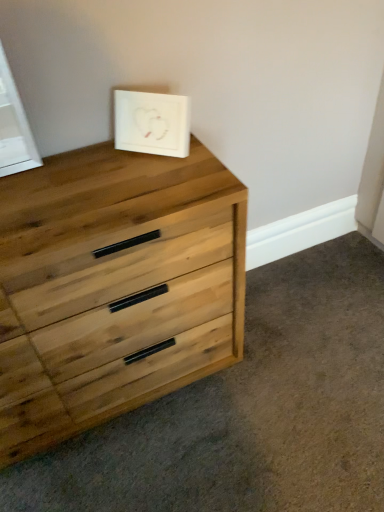
Where is `vacant space in front of white matte picture frame at upper center`? The height and width of the screenshot is (512, 384). vacant space in front of white matte picture frame at upper center is located at coordinates (163, 175).